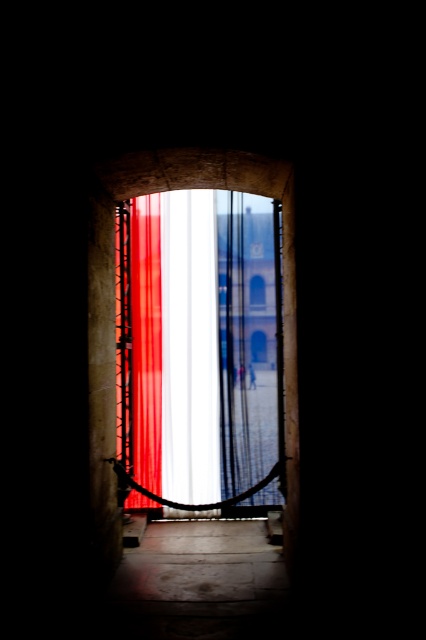
Who is higher up, translucent fabric curtain at center or smooth red curtain at center?

smooth red curtain at center is above.

Is translucent fabric curtain at center in front of smooth red curtain at center?

No, translucent fabric curtain at center is further to the viewer.

The width and height of the screenshot is (426, 640). What are the coordinates of `translucent fabric curtain at center` in the screenshot? It's located at (198, 352).

Locate an element on the screen. This screenshot has height=640, width=426. translucent fabric curtain at center is located at coordinates (198, 352).